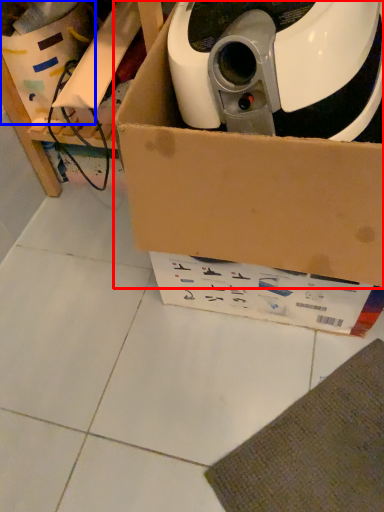
Question: Which object is further to the camera taking this photo, box (highlighted by a red box) or storage box (highlighted by a blue box)?

Choices:
 (A) box
 (B) storage box

Answer: (B)